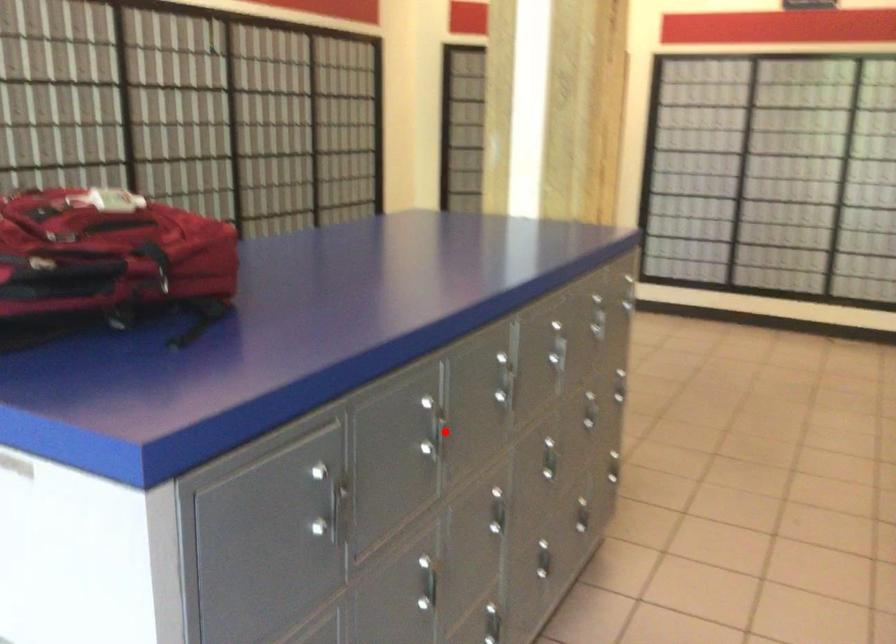
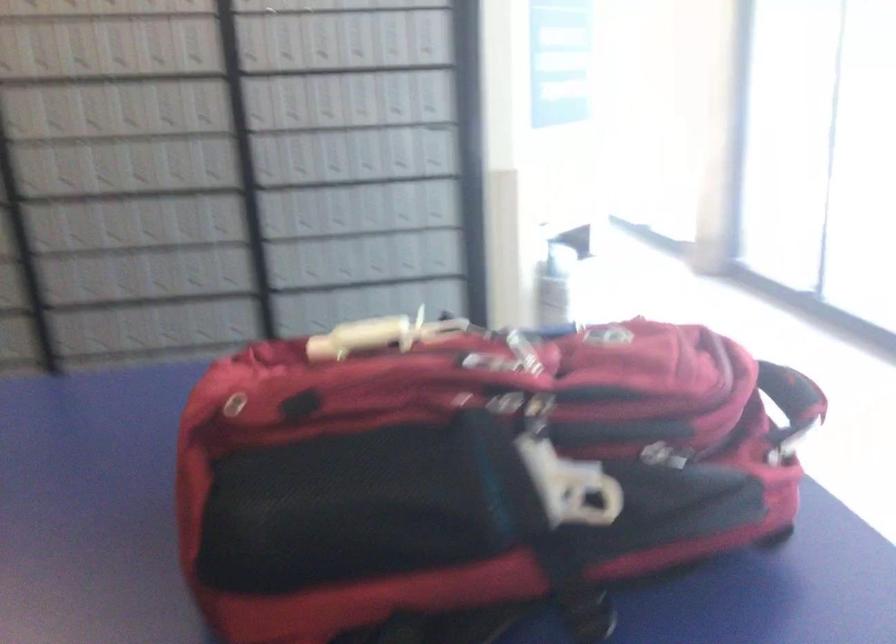
Question: I am providing you with two images of the same scene from different viewpoints. A red point is marked on the first image. At the location where the point appears in image 1, is it still visible in image 2?

Choices:
 (A) Yes
 (B) No

Answer: (B)